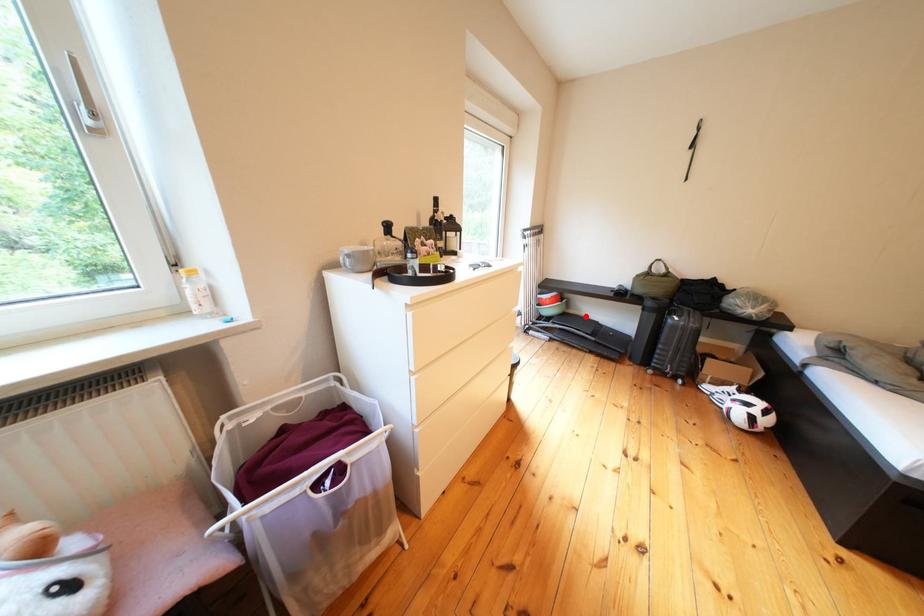
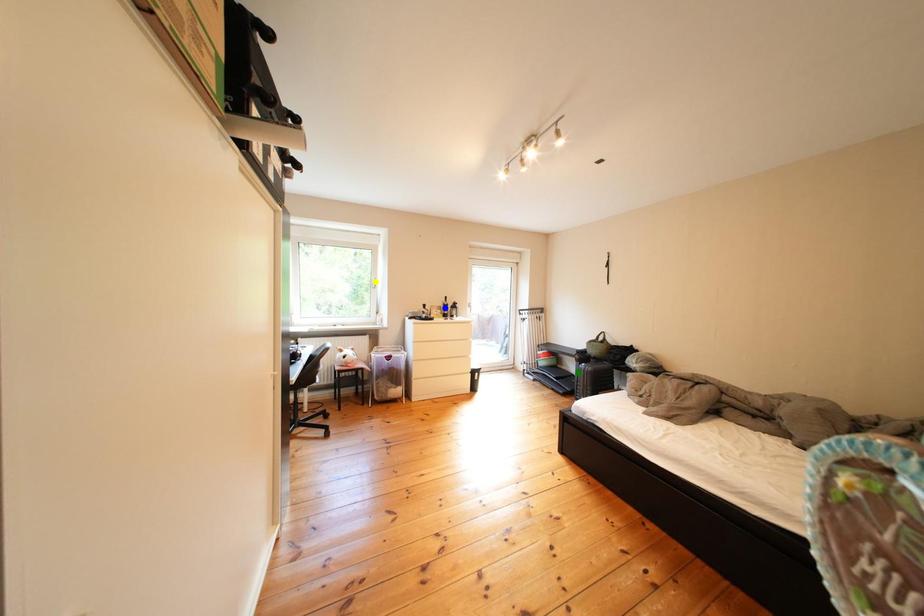
Question: I am providing you with two images of the same scene from different viewpoints. A red point is marked on the first image. You are given multiple points on the second image. Which mark in image 2 goes with the point in image 1?

Choices:
 (A) blue point
 (B) green point
 (C) yellow point

Answer: (B)